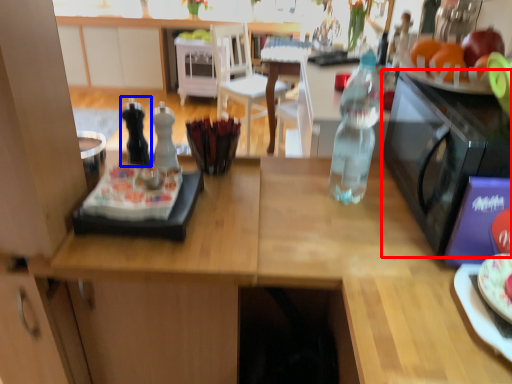
Question: Which of the following is the closest to the observer, microwave oven (highlighted by a red box) or bottle (highlighted by a blue box)?

Choices:
 (A) microwave oven
 (B) bottle

Answer: (A)